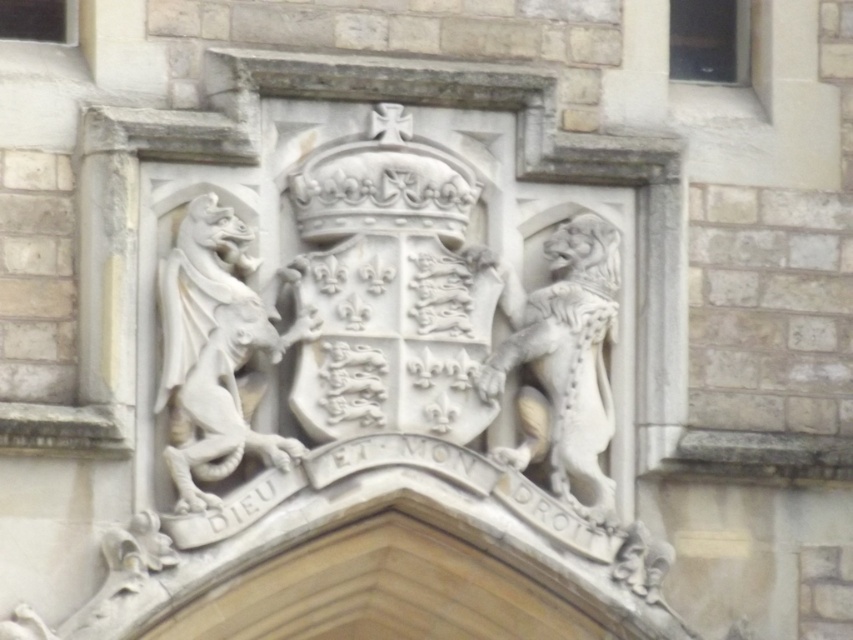
You are an architect examining a historical building facade. You notice a point marked at coordinates (218, 349). Based on the scene description, what object is located at this point?

The point at coordinates (218, 349) indicates the location of the white stone gargoyle at upper left.

You are an architect examining the stone carving. You need to install a protective glass panel that covers both the white stone gargoyle at upper left and the white stone lion at right. Based on their positions, which direction should the glass panel be placed relative to the lion?

The white stone gargoyle at upper left is to the left of the white stone lion at right, so the glass panel should be placed to the left of the white stone lion at right to cover both.

You are an architect examining the stone carving. You need to determine which of the two figures, the white stone gargoyle at upper left or the white stone lion at right, takes up more space in the carving. Based on the carving, which one is larger?

The white stone lion at right takes up more space than the white stone gargoyle at upper left because the white stone gargoyle at upper left occupies less space than white stone lion at right.